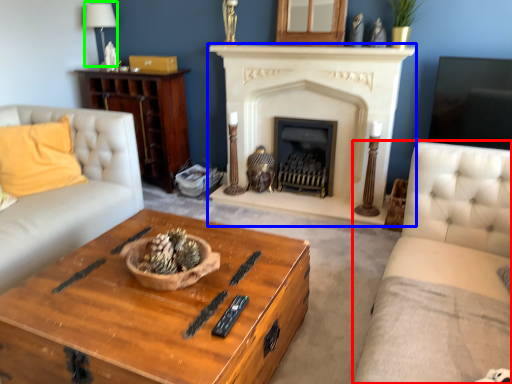
Question: Which object is the closest to the studio couch (highlighted by a red box)? Choose among these: fireplace (highlighted by a blue box) or lamp (highlighted by a green box).

Choices:
 (A) fireplace
 (B) lamp

Answer: (A)